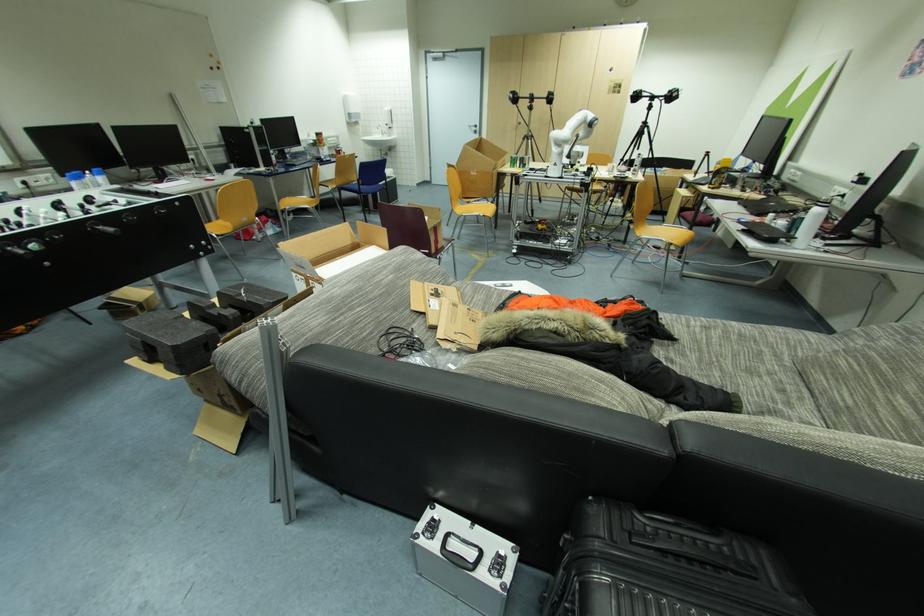
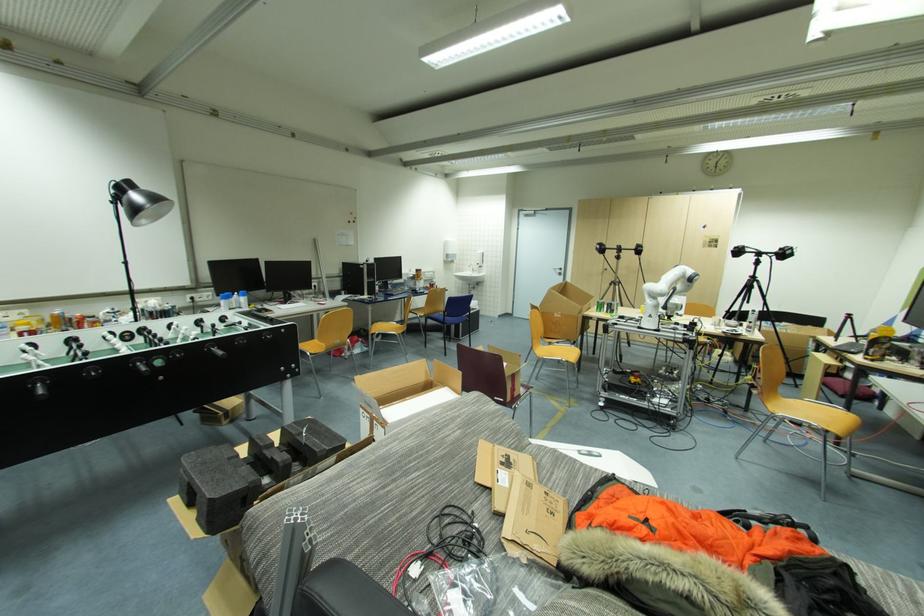
In the second image, find the point that corresponds to (x=475, y=131) in the first image.

(560, 273)